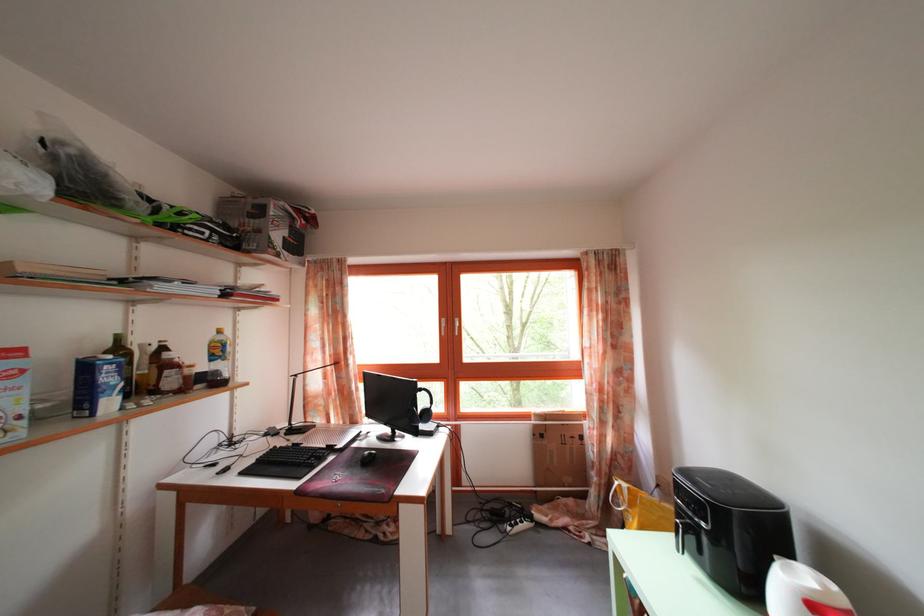
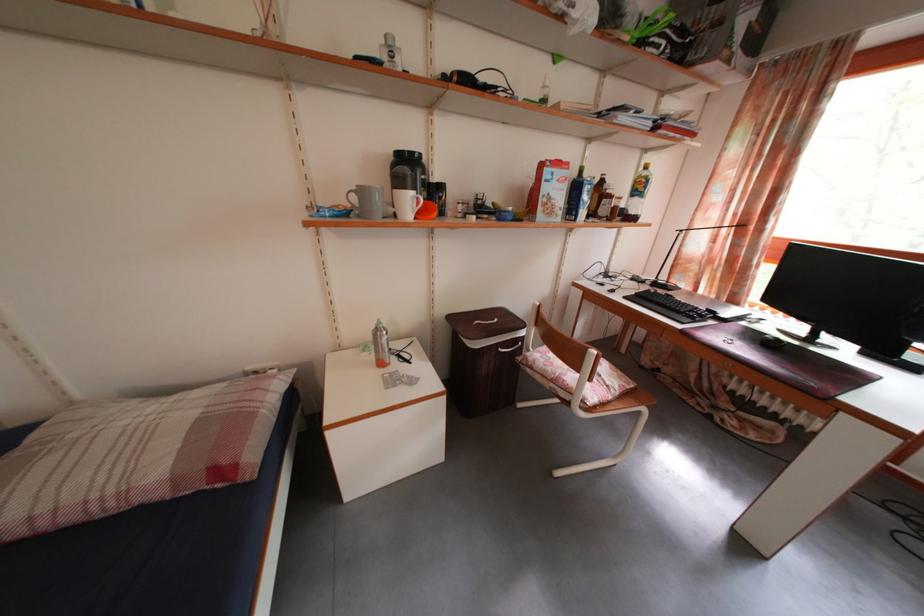
In the second image, find the point that corresponds to (306,428) in the first image.

(671, 285)